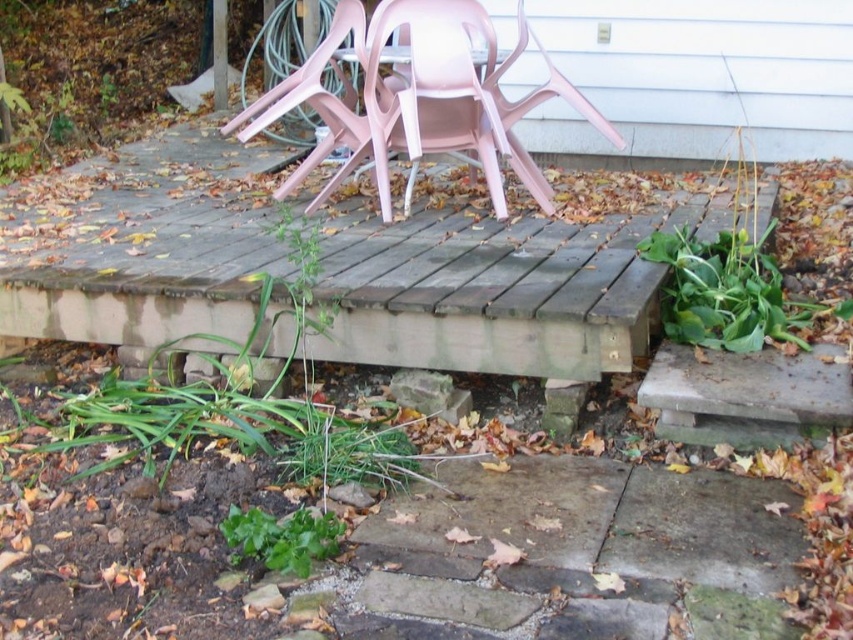
Does weathered wood deck at center have a lesser width compared to pink plastic chairs at upper center?

Incorrect, weathered wood deck at center's width is not less than pink plastic chairs at upper center's.

Can you confirm if weathered wood deck at center is positioned to the right of pink plastic chairs at upper center?

No, weathered wood deck at center is not to the right of pink plastic chairs at upper center.

Is point (625, 342) closer to viewer compared to point (511, 131)?

Yes, it is in front of point (511, 131).

Image resolution: width=853 pixels, height=640 pixels. What are the coordinates of `weathered wood deck at center` in the screenshot? It's located at (494, 288).